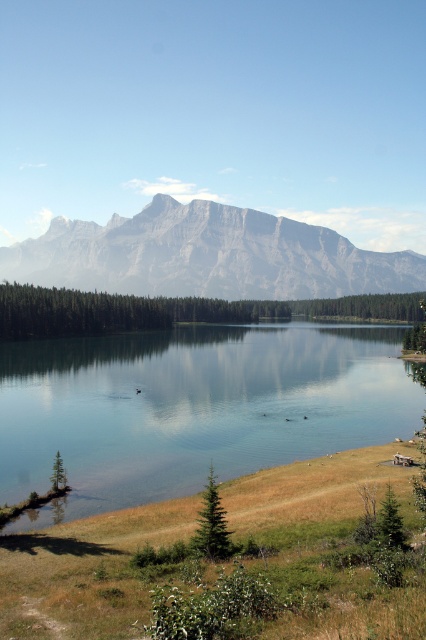
You are standing at the edge of the lake and notice the clear glass water at center and the green leafy trees at center. Which object is positioned to the left?

The clear glass water at center is to the left of green leafy trees at center.